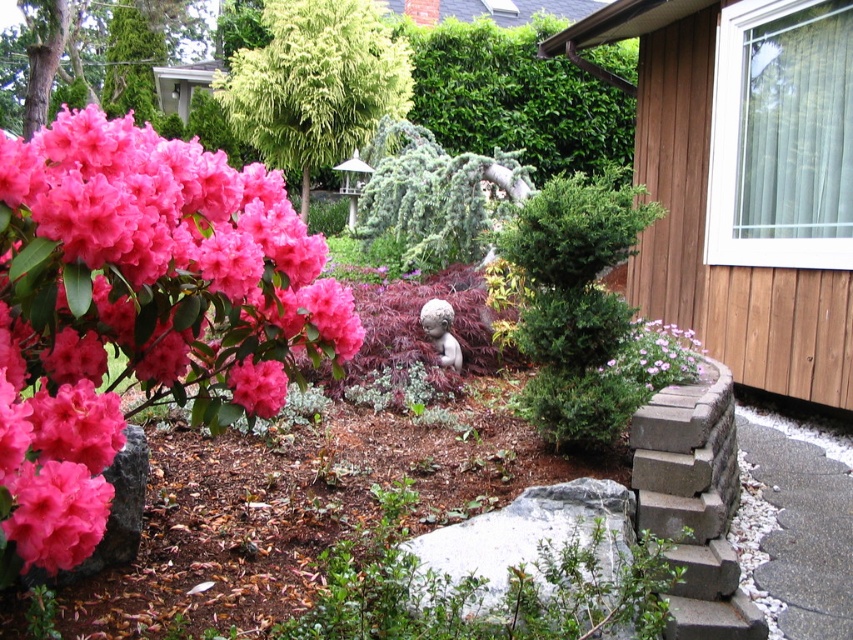
Question: Is pink matte flowers at center-right positioned before matte pink flower at center-left?

Choices:
 (A) no
 (B) yes

Answer: (A)

Question: Which of the following is the farthest from the observer?

Choices:
 (A) pink matte flower at upper left
 (B) matte pink flower at center-left
 (C) pink matte flowers at center-right

Answer: (A)

Question: Can you confirm if pink matte flowers at center-right is positioned above matte pink flower at center-left?

Choices:
 (A) yes
 (B) no

Answer: (A)

Question: Among these objects, which one is farthest from the camera?

Choices:
 (A) matte pink flowers at upper left
 (B) green leafy bush at upper center
 (C) matte pink flower at center-left

Answer: (B)

Question: Does green leafy bush at upper center come in front of green leafy tree at upper center?

Choices:
 (A) no
 (B) yes

Answer: (A)

Question: Which point appears farthest from the camera in this image?

Choices:
 (A) (473, 202)
 (B) (506, 61)
 (C) (289, 204)

Answer: (B)